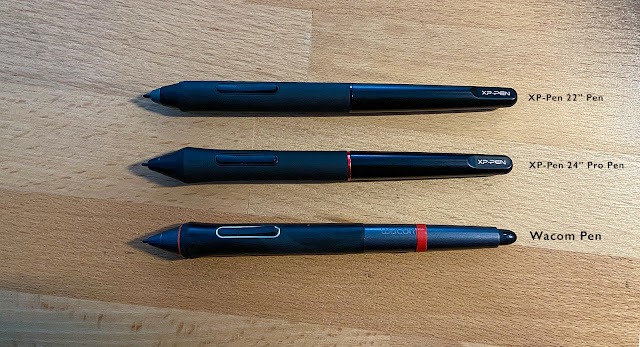
This screenshot has height=347, width=640. In order to click on light wood tabletop in this screenshot , I will do `click(99, 278)`.